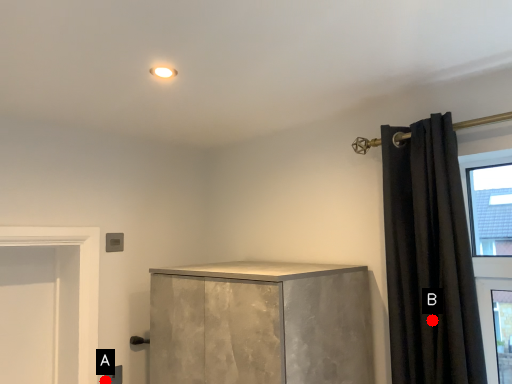
Question: Two points are circled on the image, labeled by A and B beside each circle. Which point is further to the camera?

Choices:
 (A) A is further
 (B) B is further

Answer: (A)